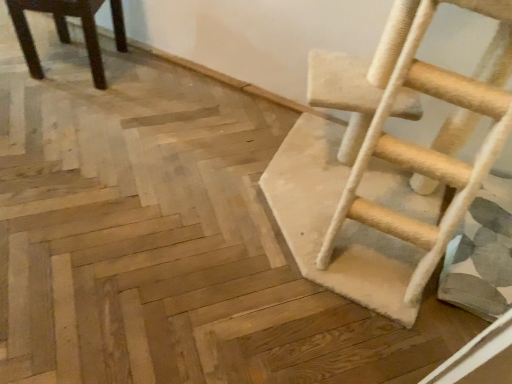
Find the location of `free point below beige carpeted ladder at right (from a real-world perspective)`. free point below beige carpeted ladder at right (from a real-world perspective) is located at coordinates (333, 204).